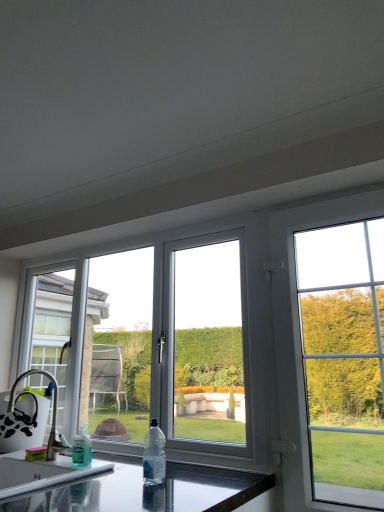
Identify the location of free region on the left part of clear plastic bottle at lower left, positioned as the 1th bottle in left-to-right order. This screenshot has width=384, height=512. pos(35,463).